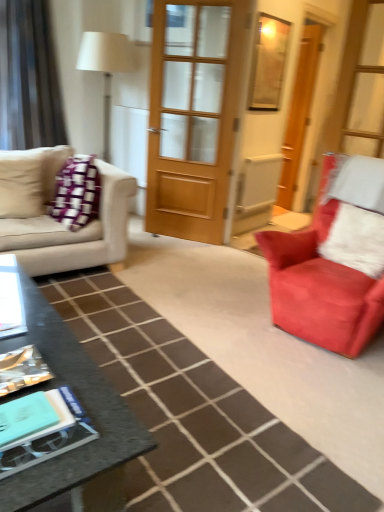
The image size is (384, 512). I want to click on silky beige curtain at left, so pos(28,78).

What is the approximate height of beige fabric couch at left?

The height of beige fabric couch at left is 32.86 inches.

Describe the element at coordinates (356, 240) in the screenshot. I see `white fluffy pillow at right` at that location.

Identify the location of suede red armchair at right. Image resolution: width=384 pixels, height=512 pixels. (320, 285).

Based on the photo, is wooden frame at upper center completely or partially outside of suede red armchair at right?

Yes, wooden frame at upper center is not within suede red armchair at right.

How different are the orientations of wooden frame at upper center and suede red armchair at right in degrees?

94.1 degrees separate the facing orientations of wooden frame at upper center and suede red armchair at right.

Is wooden frame at upper center not close to suede red armchair at right?

Absolutely, wooden frame at upper center is distant from suede red armchair at right.

Is wooden frame at upper center looking in the opposite direction of suede red armchair at right?

That's not correct — wooden frame at upper center is not looking away from suede red armchair at right.

Does wooden door at center, arranged as the first door when viewed from the right, lie behind smooth black coffee table at center?

Yes, wooden door at center, arranged as the first door when viewed from the right, is further from the viewer.

Between wooden door at center, which ranks as the 2th door in left-to-right order, and smooth black coffee table at center, which one has smaller size?

With smaller size is wooden door at center, which ranks as the 2th door in left-to-right order.

From the picture: Are wooden door at center, arranged as the first door when viewed from the right, and smooth black coffee table at center located far from each other?

Yes, wooden door at center, arranged as the first door when viewed from the right, is far from smooth black coffee table at center.

Consider the image. In the image, is wooden door at center, placed as the first door when sorted from back to front, on the left side or the right side of smooth black coffee table at center?

In the image, wooden door at center, placed as the first door when sorted from back to front, appears on the right side of smooth black coffee table at center.

In the scene shown: Is white fluffy pillow at right looking in the opposite direction of wooden frame at upper center?

No, white fluffy pillow at right's orientation is not away from wooden frame at upper center.

Is white fluffy pillow at right in front of or behind wooden frame at upper center in the image?

Clearly, white fluffy pillow at right is in front of wooden frame at upper center.

Which is in front, point (378, 249) or point (272, 93)?

Point (378, 249)

Is white fluffy pillow at right outside of wooden frame at upper center?

Yes, white fluffy pillow at right is located beyond the bounds of wooden frame at upper center.

Which of these two, wooden door at center, acting as the 2th door starting from the front, or silky beige curtain at left, stands taller?

With more height is wooden door at center, acting as the 2th door starting from the front.

Is point (321, 44) behind point (20, 5)?

Yes, it is behind point (20, 5).

From a real-world perspective, starting from the silky beige curtain at left, which door is the 1st one below it? Please provide its 2D coordinates.

[(299, 110)]

From the picture: From a real-world perspective, between wooden door at center, arranged as the first door when viewed from the right, and silky beige curtain at left, who is vertically lower?

From a 3D spatial view, wooden door at center, arranged as the first door when viewed from the right, is below.

Based on their sizes in the image, would you say beige fabric couch at left is bigger or smaller than silky beige curtain at left?

Considering their sizes, beige fabric couch at left takes up more space than silky beige curtain at left.

Is the depth of beige fabric couch at left less than that of silky beige curtain at left?

Yes.

Which of these two, beige fabric couch at left or silky beige curtain at left, stands shorter?

beige fabric couch at left is shorter.

From the picture: From a real-world perspective, which is physically below, beige fabric couch at left or silky beige curtain at left?

From a 3D spatial view, beige fabric couch at left is below.

Are wooden frame at upper center and silky beige curtain at left making contact?

No, wooden frame at upper center is not next to silky beige curtain at left.

Is point (272, 60) farther from camera compared to point (2, 144)?

No, (272, 60) is closer to viewer.

Is wooden frame at upper center facing away from silky beige curtain at left?

No, wooden frame at upper center's orientation is not away from silky beige curtain at left.

From a real-world perspective, is wooden frame at upper center under wooden door at center, placed as the second door when sorted from back to front?

No, from a real-world perspective, wooden frame at upper center is not under wooden door at center, placed as the second door when sorted from back to front.

Which is closer, (268, 79) or (223, 109)?

Point (223, 109)

Which of these two, wooden frame at upper center or wooden door at center, the 2th door viewed from the right, is thinner?

With smaller width is wooden frame at upper center.

Considering the relative positions of wooden frame at upper center and wooden door at center, placed as the second door when sorted from back to front, in the image provided, is wooden frame at upper center to the right of wooden door at center, placed as the second door when sorted from back to front, from the viewer's perspective?

Yes, wooden frame at upper center is to the right of wooden door at center, placed as the second door when sorted from back to front.

The image size is (384, 512). I want to click on window screen behind the suede red armchair at right, so click(x=268, y=63).

I want to click on plain in front of the wooden door at center, arranged as the first door when viewed from the right, so click(194, 414).

Based on their spatial positions, is silky beige curtain at left or smooth black coffee table at center further from wooden frame at upper center?

Based on the image, smooth black coffee table at center appears to be further to wooden frame at upper center.

Consider the image. Which object lies further to the anchor point beige fabric couch at left, white fluffy pillow at right or granite black coffee table at lower left?

The object further to beige fabric couch at left is white fluffy pillow at right.

Based on the photo, when comparing their distances from silky beige curtain at left, does beige fabric couch at left or wooden door at center, placed as the first door when sorted from back to front, seem further?

wooden door at center, placed as the first door when sorted from back to front.

Looking at the image, which one is located further to smooth black coffee table at center, silky beige curtain at left or wooden frame at upper center?

silky beige curtain at left is further to smooth black coffee table at center.

When comparing their distances from silky beige curtain at left, does granite black coffee table at lower left or white fluffy pillow at right seem further?

The object further to silky beige curtain at left is white fluffy pillow at right.

From the image, which object appears to be farther from wooden door at center, placed as the first door when sorted from back to front, granite black coffee table at lower left or wooden door at center, the 1th door viewed from the left?

The object further to wooden door at center, placed as the first door when sorted from back to front, is granite black coffee table at lower left.

Considering their positions, is wooden door at center, the 2th door viewed from the right, positioned further to silky beige curtain at left than white fluffy pillow at right?

white fluffy pillow at right.

Based on their spatial positions, is wooden door at center, acting as the 2th door starting from the front, or wooden door at center, placed as the second door when sorted from back to front, closer to suede red armchair at right?

Based on the image, wooden door at center, placed as the second door when sorted from back to front, appears to be nearer to suede red armchair at right.

Where is `studio couch positioned between granite black coffee table at lower left and silky beige curtain at left from near to far`? This screenshot has height=512, width=384. studio couch positioned between granite black coffee table at lower left and silky beige curtain at left from near to far is located at coordinates (54, 220).

Locate an element on the screen. pillow between granite black coffee table at lower left and wooden door at center, arranged as the first door when viewed from the right, in the front-back direction is located at coordinates (356, 240).

The width and height of the screenshot is (384, 512). In order to click on studio couch between silky beige curtain at left and suede red armchair at right from left to right in this screenshot , I will do `click(54, 220)`.

At what (x,y) coordinates should I click in order to perform the action: click on studio couch between smooth black coffee table at center and wooden door at center, the 2th door viewed from the right, along the z-axis. Please return your answer as a coordinate pair (x, y). Looking at the image, I should click on (54, 220).